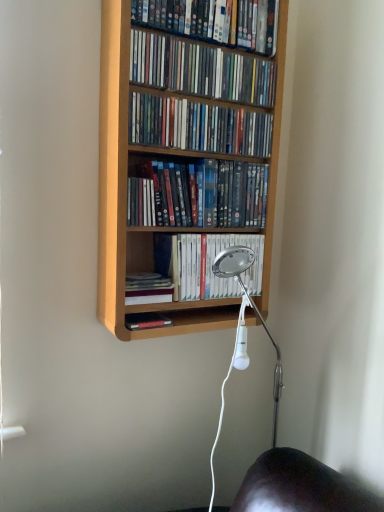
Where is `matte plastic dvds at upper center, which ranks as the third book in top-to-bottom order`? The image size is (384, 512). matte plastic dvds at upper center, which ranks as the third book in top-to-bottom order is located at coordinates (198, 126).

What is the approximate width of white glossy book at center, the 5th book in the top-to-bottom sequence?

It is 6.06 inches.

What do you see at coordinates (215, 21) in the screenshot?
I see `matte plastic dvds at upper center, the sixth book positioned from the bottom` at bounding box center [215, 21].

This screenshot has height=512, width=384. I want to click on matte plastic dvds at upper center, the first book positioned from the top, so click(x=215, y=21).

At what (x,y) coordinates should I click in order to perform the action: click on matte plastic dvds at upper center, which is the 5th book from bottom to top. Please return your answer as a coordinate pair (x, y). Looking at the image, I should click on (201, 70).

Is hardcover book at center, arranged as the 1th book when ordered from the bottom, positioned in front of matte plastic dvds at center, positioned as the 4th book in top-to-bottom order?

No, hardcover book at center, arranged as the 1th book when ordered from the bottom, is further to the viewer.

Is hardcover book at center, marked as the sixth book in a top-to-bottom arrangement, beside matte plastic dvds at center, positioned as the 4th book in top-to-bottom order?

No, hardcover book at center, marked as the sixth book in a top-to-bottom arrangement, is not making contact with matte plastic dvds at center, positioned as the 4th book in top-to-bottom order.

Can you tell me how much hardcover book at center, marked as the sixth book in a top-to-bottom arrangement, and matte plastic dvds at center, positioned as the 4th book in top-to-bottom order, differ in facing direction?

0.0013 degrees separate the facing orientations of hardcover book at center, marked as the sixth book in a top-to-bottom arrangement, and matte plastic dvds at center, positioned as the 4th book in top-to-bottom order.

Which book is the 1st one when counting from the front of the hardcover book at center, marked as the sixth book in a top-to-bottom arrangement? Please provide its 2D coordinates.

[(199, 195)]

Considering the sizes of objects white glossy book at center, the 5th book in the top-to-bottom sequence, and light wood bookcase at center in the image provided, who is taller, white glossy book at center, the 5th book in the top-to-bottom sequence, or light wood bookcase at center?

Standing taller between the two is light wood bookcase at center.

Which object is closer to the camera taking this photo, white glossy book at center, the 5th book in the top-to-bottom sequence, or light wood bookcase at center?

light wood bookcase at center is more forward.

Is white glossy book at center, the 5th book in the top-to-bottom sequence, inside the boundaries of light wood bookcase at center, or outside?

white glossy book at center, the 5th book in the top-to-bottom sequence, is located inside light wood bookcase at center.

Considering the positions of points (182, 289) and (244, 128), is point (182, 289) closer to camera compared to point (244, 128)?

Yes, point (182, 289) is in front of point (244, 128).

Between matte plastic dvds at upper center, which ranks as the third book in top-to-bottom order, and matte plastic dvds at upper center, the first book positioned from the top, which one has larger size?

Bigger between the two is matte plastic dvds at upper center, the first book positioned from the top.

Can you tell me how much matte plastic dvds at upper center, which appears as the fourth book when ordered from the bottom, and matte plastic dvds at upper center, the sixth book positioned from the bottom, differ in facing direction?

0.319 degrees.

Is the surface of matte plastic dvds at upper center, which ranks as the third book in top-to-bottom order, in direct contact with matte plastic dvds at upper center, the sixth book positioned from the bottom?

matte plastic dvds at upper center, which ranks as the third book in top-to-bottom order, is not next to matte plastic dvds at upper center, the sixth book positioned from the bottom, and they're not touching.

From the matte plastic dvds at upper center, the sixth book positioned from the bottom, count the 2nd book to the left and point to it. Please provide its 2D coordinates.

[(198, 126)]

Is matte plastic dvds at center, the 3th book from the bottom, not inside light wood bookcase at center?

Actually, matte plastic dvds at center, the 3th book from the bottom, is within light wood bookcase at center.

Between matte plastic dvds at center, positioned as the 4th book in top-to-bottom order, and light wood bookcase at center, which one has larger width?

light wood bookcase at center.

From the image's perspective, is matte plastic dvds at center, the 3th book from the bottom, positioned above or below light wood bookcase at center?

matte plastic dvds at center, the 3th book from the bottom, is situated lower than light wood bookcase at center in the image.

From the matte plastic dvds at upper center, which ranks as the third book in top-to-bottom order, count 1st books backward and point to it. Please provide its 2D coordinates.

[(199, 195)]

Looking at this image, considering the sizes of matte plastic dvds at center, the 3th book from the bottom, and matte plastic dvds at upper center, which ranks as the third book in top-to-bottom order, in the image, is matte plastic dvds at center, the 3th book from the bottom, taller or shorter than matte plastic dvds at upper center, which ranks as the third book in top-to-bottom order,?

matte plastic dvds at center, the 3th book from the bottom, is taller than matte plastic dvds at upper center, which ranks as the third book in top-to-bottom order.

In the image, is matte plastic dvds at center, positioned as the 4th book in top-to-bottom order, positioned in front of or behind matte plastic dvds at upper center, which appears as the fourth book when ordered from the bottom?

matte plastic dvds at center, positioned as the 4th book in top-to-bottom order, is behind matte plastic dvds at upper center, which appears as the fourth book when ordered from the bottom.

From the image's perspective, which one is positioned higher, matte plastic dvds at center, the 3th book from the bottom, or matte plastic dvds at upper center, which ranks as the third book in top-to-bottom order?

matte plastic dvds at upper center, which ranks as the third book in top-to-bottom order, appears higher in the image.

Visually, is white glossy book at center, acting as the second book starting from the bottom, positioned to the left or to the right of matte plastic dvds at upper center, which appears as the fourth book when ordered from the bottom?

In the image, white glossy book at center, acting as the second book starting from the bottom, appears on the right side of matte plastic dvds at upper center, which appears as the fourth book when ordered from the bottom.

Who is smaller, white glossy book at center, acting as the second book starting from the bottom, or matte plastic dvds at upper center, which appears as the fourth book when ordered from the bottom?

With smaller size is matte plastic dvds at upper center, which appears as the fourth book when ordered from the bottom.

Where is `the 2nd book above when counting from the white glossy book at center, the 5th book in the top-to-bottom sequence (from the image's perspective)`? This screenshot has width=384, height=512. the 2nd book above when counting from the white glossy book at center, the 5th book in the top-to-bottom sequence (from the image's perspective) is located at coordinates 198,126.

Which point is more forward, (188, 297) or (241, 154)?

The point (188, 297) is closer.

Between hardcover book at center, arranged as the 1th book when ordered from the bottom, and matte plastic dvds at upper center, which ranks as the third book in top-to-bottom order, which one is positioned behind?

hardcover book at center, arranged as the 1th book when ordered from the bottom, is further away from the camera.

Could you tell me if hardcover book at center, arranged as the 1th book when ordered from the bottom, is turned towards matte plastic dvds at upper center, which ranks as the third book in top-to-bottom order?

No, hardcover book at center, arranged as the 1th book when ordered from the bottom, is not facing towards matte plastic dvds at upper center, which ranks as the third book in top-to-bottom order.

From the picture: Which is more distant, (x=155, y=291) or (x=146, y=136)?

Point (x=155, y=291)

From the image's perspective, which book is the 2nd one below the matte plastic dvds at center, the 3th book from the bottom? Please provide its 2D coordinates.

[(147, 288)]

I want to click on bookcase lying above the white glossy book at center, the 5th book in the top-to-bottom sequence (from the image's perspective), so pyautogui.click(x=182, y=159).

Estimate the real-world distances between objects in this image. Which object is closer to light wood bookcase at center, white glossy book at center, the 5th book in the top-to-bottom sequence, or matte plastic dvds at upper center, which appears as the fourth book when ordered from the bottom?

matte plastic dvds at upper center, which appears as the fourth book when ordered from the bottom, is closer to light wood bookcase at center.

From the image, which object appears to be farther from light wood bookcase at center, matte plastic dvds at center, the 3th book from the bottom, or matte plastic dvds at upper center, which appears as the fourth book when ordered from the bottom?

matte plastic dvds at upper center, which appears as the fourth book when ordered from the bottom.

Which object lies nearer to the anchor point matte plastic dvds at upper center, which ranks as the third book in top-to-bottom order, light wood bookcase at center or white glossy book at center, acting as the second book starting from the bottom?

Based on the image, light wood bookcase at center appears to be nearer to matte plastic dvds at upper center, which ranks as the third book in top-to-bottom order.

Which object lies nearer to the anchor point light wood bookcase at center, matte plastic dvds at upper center, which appears as the fourth book when ordered from the bottom, or matte plastic dvds at upper center, which is the 5th book from bottom to top?

matte plastic dvds at upper center, which appears as the fourth book when ordered from the bottom.

Considering their positions, is matte plastic dvds at upper center, which ranks as the third book in top-to-bottom order, positioned closer to light wood bookcase at center than matte plastic dvds at center, the 3th book from the bottom?

Based on the image, matte plastic dvds at center, the 3th book from the bottom, appears to be nearer to light wood bookcase at center.

Based on their spatial positions, is matte plastic dvds at upper center, which is the 5th book from bottom to top, or hardcover book at center, arranged as the 1th book when ordered from the bottom, closer to light wood bookcase at center?

matte plastic dvds at upper center, which is the 5th book from bottom to top, lies closer to light wood bookcase at center than the other object.

Based on their spatial positions, is matte plastic dvds at upper center, which appears as the second book when viewed from the top, or matte plastic dvds at center, the 3th book from the bottom, further from hardcover book at center, marked as the sixth book in a top-to-bottom arrangement?

Among the two, matte plastic dvds at upper center, which appears as the second book when viewed from the top, is located further to hardcover book at center, marked as the sixth book in a top-to-bottom arrangement.

From the picture: When comparing their distances from matte plastic dvds at upper center, which appears as the fourth book when ordered from the bottom, does hardcover book at center, marked as the sixth book in a top-to-bottom arrangement, or matte plastic dvds at upper center, which appears as the second book when viewed from the top, seem closer?

matte plastic dvds at upper center, which appears as the second book when viewed from the top, lies closer to matte plastic dvds at upper center, which appears as the fourth book when ordered from the bottom, than the other object.

The image size is (384, 512). Identify the location of bookcase between matte plastic dvds at upper center, the sixth book positioned from the bottom, and white glossy book at center, acting as the second book starting from the bottom, vertically. (182, 159).

Where is `book between matte plastic dvds at upper center, the sixth book positioned from the bottom, and matte plastic dvds at upper center, which ranks as the third book in top-to-bottom order, from top to bottom`? The image size is (384, 512). book between matte plastic dvds at upper center, the sixth book positioned from the bottom, and matte plastic dvds at upper center, which ranks as the third book in top-to-bottom order, from top to bottom is located at coordinates (201, 70).

Find the location of a particular element. book that lies between matte plastic dvds at upper center, which appears as the second book when viewed from the top, and matte plastic dvds at center, positioned as the 4th book in top-to-bottom order, from top to bottom is located at coordinates (198, 126).

This screenshot has height=512, width=384. Find the location of `bookcase that lies between matte plastic dvds at upper center, which ranks as the third book in top-to-bottom order, and matte plastic dvds at center, the 3th book from the bottom, from top to bottom`. bookcase that lies between matte plastic dvds at upper center, which ranks as the third book in top-to-bottom order, and matte plastic dvds at center, the 3th book from the bottom, from top to bottom is located at coordinates (182, 159).